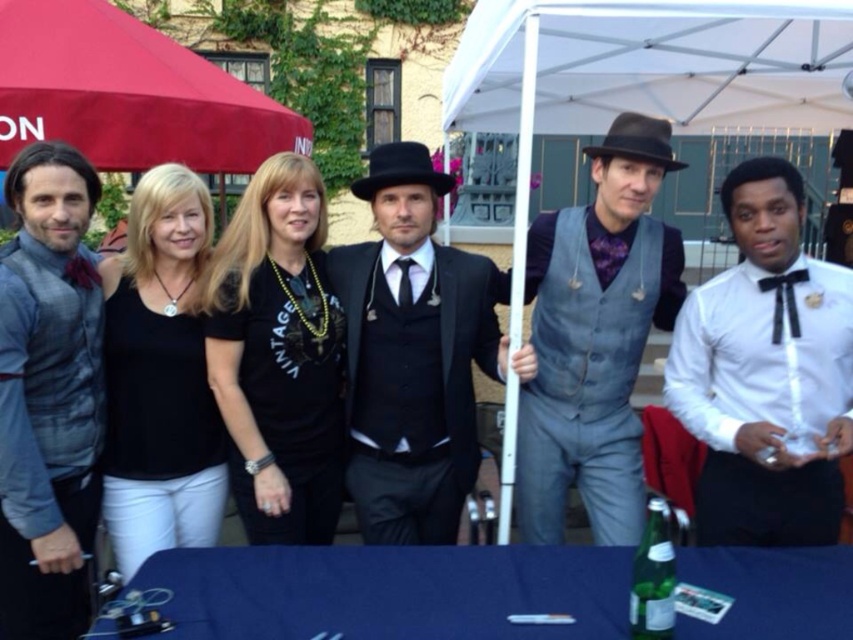
You are a photographer at the event and want to ensure that the white satin shirt at right is fully visible in the photo. Is the red fabric umbrella at upper left blocking its view?

The white satin shirt at right is positioned under the red fabric umbrella at upper left, so the umbrella is blocking its view.